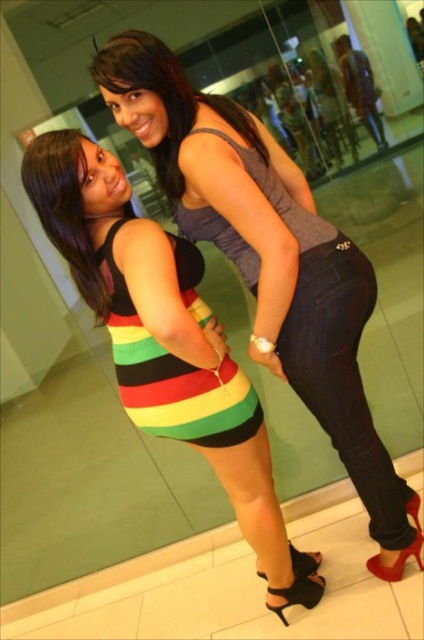
Question: Is striped fabric dress at center above multicolored striped tank top at center?

Choices:
 (A) yes
 (B) no

Answer: (A)

Question: Which point is farther to the camera?

Choices:
 (A) (198, 113)
 (B) (75, 145)
 (C) (180, 324)

Answer: (A)

Question: Which point is farther from the camera taking this photo?

Choices:
 (A) (296, 189)
 (B) (55, 204)
 (C) (53, 221)
 (D) (206, 396)

Answer: (A)

Question: Which of these objects is positioned closest to the multicolored striped dress at center?

Choices:
 (A) jeans at center
 (B) striped fabric dress at lower left

Answer: (B)

Question: Is multicolored striped dress at center positioned behind jeans at center?

Choices:
 (A) no
 (B) yes

Answer: (A)

Question: Does striped fabric dress at center lie in front of multicolored striped tank top at center?

Choices:
 (A) yes
 (B) no

Answer: (A)